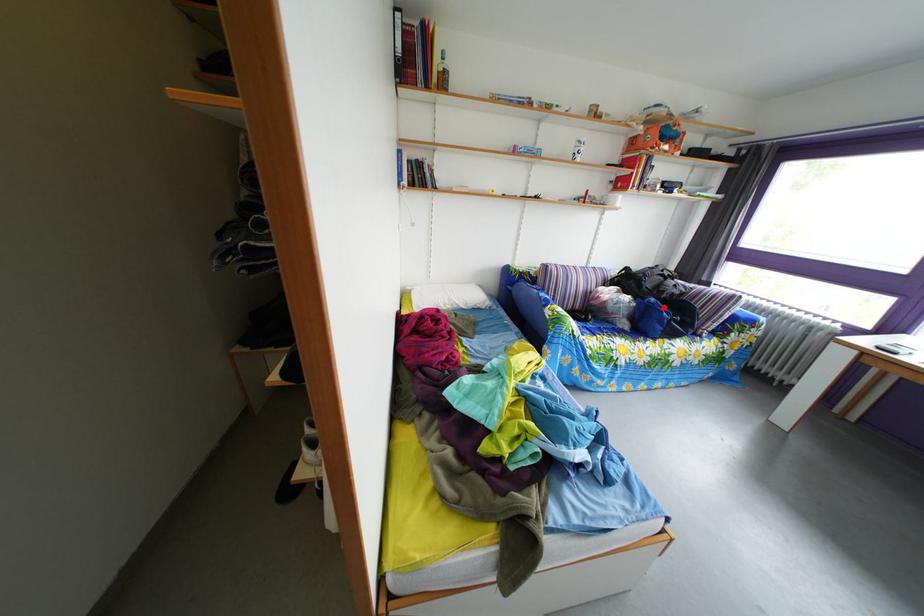
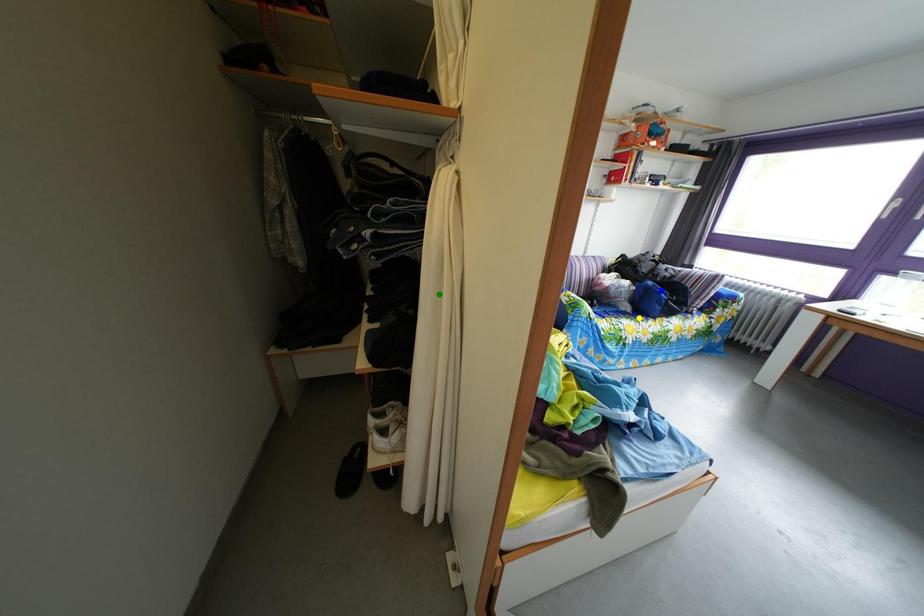
Question: I am providing you with two images of the same scene from different viewpoints. A red point is marked on the first image. You are given multiple points on the second image. Which point in image 2 is actually the same real-world point as the red point in image 1?

Choices:
 (A) green point
 (B) yellow point
 (C) blue point

Answer: (C)